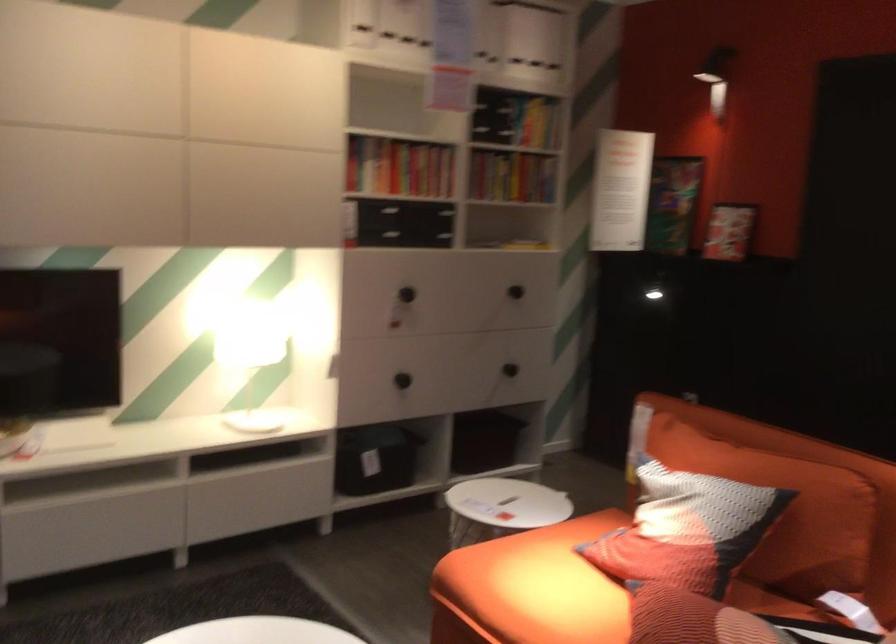
This screenshot has height=644, width=896. Identify the location of patterned throw pillow. (686, 529).